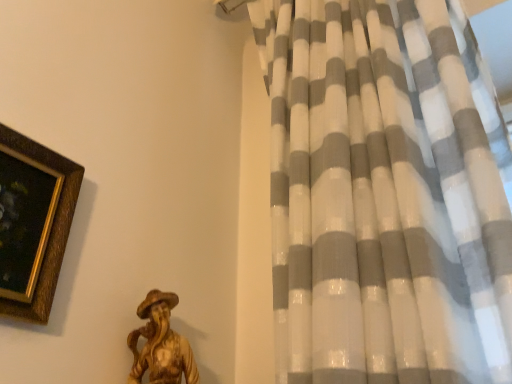
This screenshot has height=384, width=512. Describe the element at coordinates (52, 226) in the screenshot. I see `gold wood picture frame at upper left` at that location.

At what (x,y) coordinates should I click in order to perform the action: click on gold wood picture frame at upper left. Please return your answer as a coordinate pair (x, y). This screenshot has height=384, width=512. Looking at the image, I should click on (52, 226).

In order to face gold wood picture frame at upper left, should I rotate leftwards or rightwards?

Turn left by 35.854 degrees to look at gold wood picture frame at upper left.

This screenshot has width=512, height=384. Identify the location of gold wood picture frame at upper left. (52, 226).